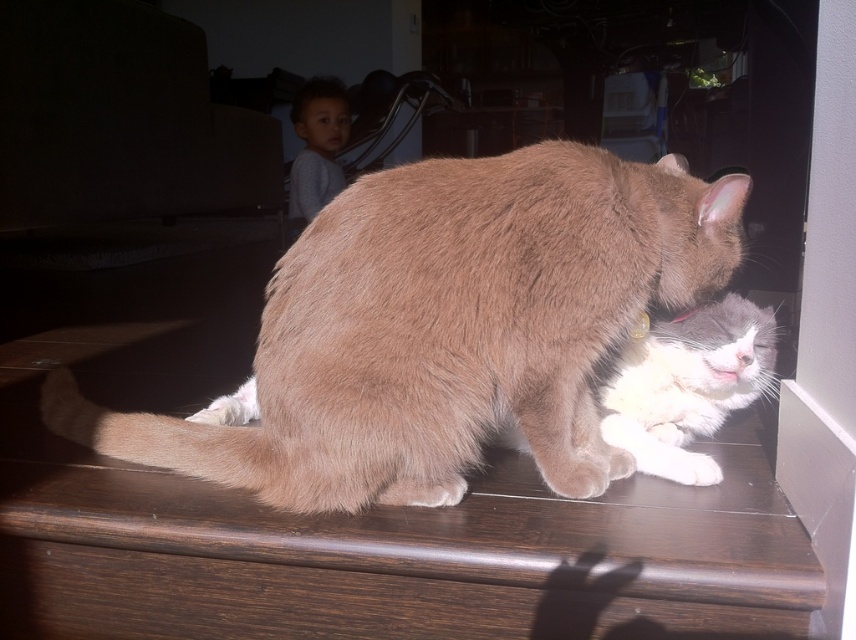
You are a photographer taking a picture of the light brown fur cat at center and the white fluffy cat at lower right. Which cat will appear larger in the photo?

The light brown fur cat at center will appear larger in the photo because it is closer to the viewer than the white fluffy cat at lower right.

You are a veterinarian examining an image of two cats. The light brown fur cat at center and the white fluffy cat at lower right are in the image. Based on their positions, which cat is on top?

The light brown fur cat at center is positioned over the white fluffy cat at lower right, so the light brown fur cat at center is on top.

You are a photographer trying to capture a photo of both the light brown fur cat at center and the white fluffy cat at lower right. Since you want both cats to appear equally sized in the photo, which cat should you move closer to the camera and which should you move further away?

To make both cats appear equally sized in the photo, you should move the white fluffy cat at lower right closer to the camera and move the light brown fur cat at center further away. This is because the light brown fur cat at center is currently larger in width than the white fluffy cat at lower right, so reducing its distance from the camera would help balance their sizes.